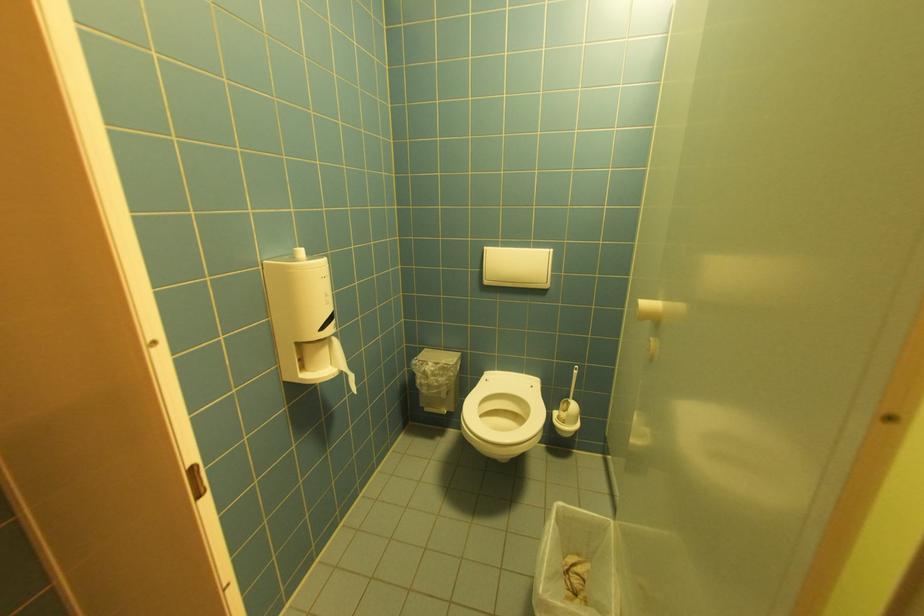
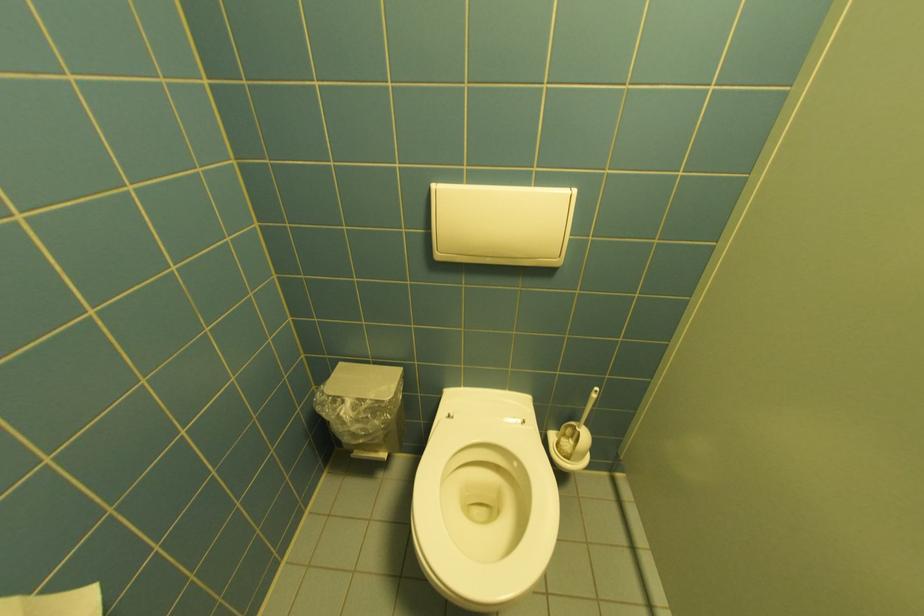
In the second image, find the point that corresponds to [538,387] in the first image.

(529, 424)